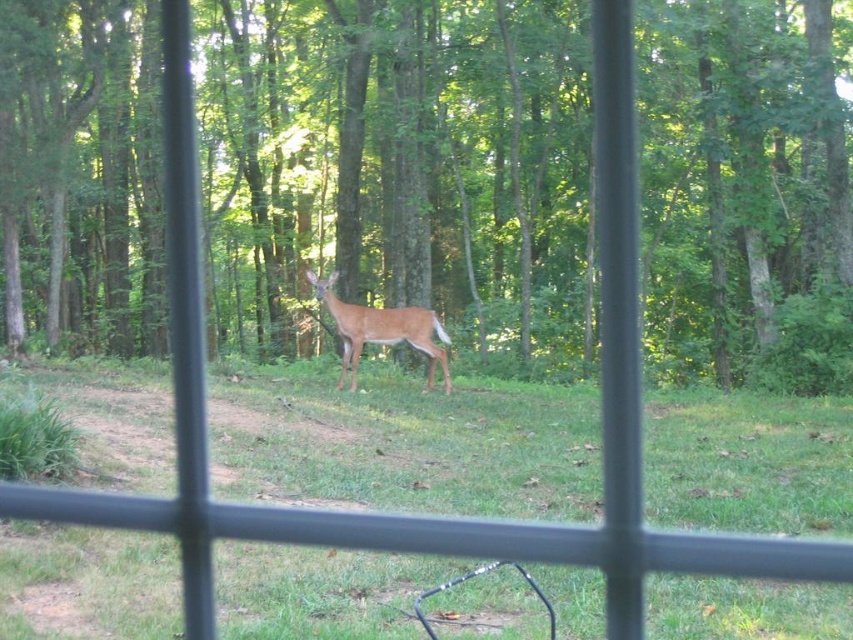
In the scene shown: You are a wildlife photographer standing at the window. You want to take a photo of the brown fur deer at center while ensuring the green grassy at center is also in the shot. Based on the distance between them, what is the minimum focal length you should use to capture both subjects in the frame?

The green grassy at center is 2.73 meters away from the brown fur deer at center. To capture both subjects in the frame, you need a focal length that allows for a wide enough angle to include both the deer and the grassy area. A focal length of around 35mm or lower would be suitable for this purpose.

You are a photographer trying to capture the entire scene through the window. You notice the green grassy at center and the brown fur deer at center. Which of these two elements is wider in the image?

The green grassy at center is wider than the brown fur deer at center.